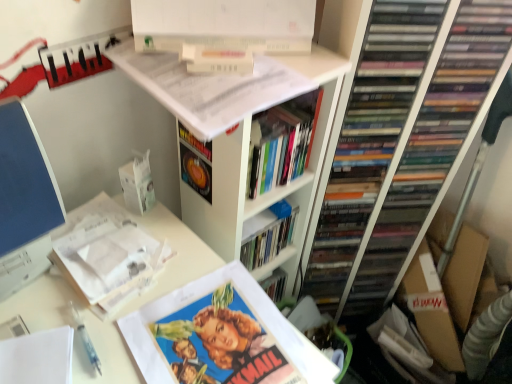
The height and width of the screenshot is (384, 512). Identify the location of free space between vintage paper movie poster at center, which is the first book in bottom-to-top order, and white paper at upper left, positioned as the 2th book in bottom-to-top order. (154, 289).